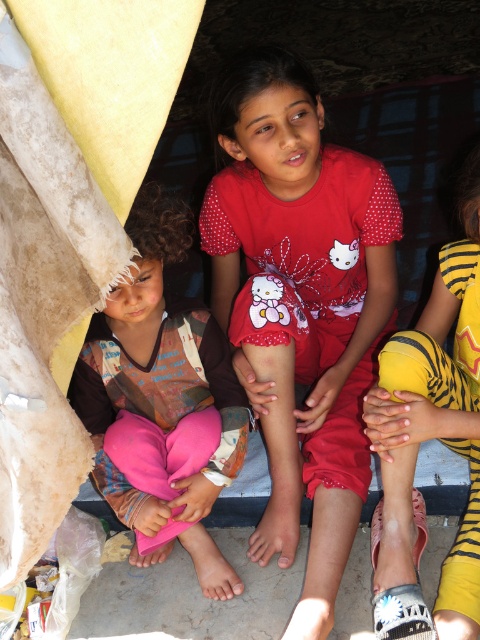
You are a photographer trying to capture a clear shot of the children in the scene. You notice the red matte shirt at center and the pink fabric pants at left. Which object is closer to the camera, and why?

The red matte shirt at center is closer to the camera because the pink fabric pants at left is behind it.

You are a photographer trying to capture the three children in the scene. You notice a specific point marked at coordinates [300,304]. Which child is this point indicating?

The point at coordinates [300,304] marks the red matte shirt at center, so it indicates the middle child wearing the red Hello Kitty outfit.